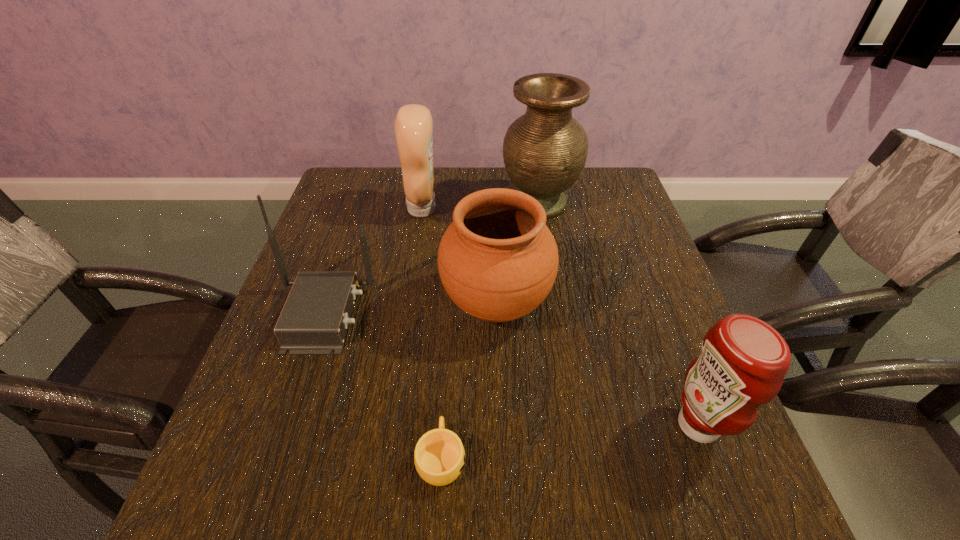
Where is `vase`? vase is located at coordinates (545, 150).

Image resolution: width=960 pixels, height=540 pixels. I want to click on the farther condiment, so click(x=413, y=127).

Where is `the left condiment`? The width and height of the screenshot is (960, 540). the left condiment is located at coordinates (413, 127).

At what (x,y) coordinates should I click in order to perform the action: click on pottery. Please return your answer as a coordinate pair (x, y). The height and width of the screenshot is (540, 960). Looking at the image, I should click on (498, 261).

Image resolution: width=960 pixels, height=540 pixels. I want to click on the rightmost object, so click(743, 361).

Image resolution: width=960 pixels, height=540 pixels. What are the coordinates of `the right condiment` in the screenshot? It's located at (743, 361).

Locate an element on the screen. This screenshot has width=960, height=540. router is located at coordinates (314, 320).

Find the location of a particular element. The width and height of the screenshot is (960, 540). the shortest object is located at coordinates (439, 456).

Identify the location of free space located 0.050m on the front of the vase. The image size is (960, 540). (545, 239).

At what (x,y) coordinates should I click in order to perform the action: click on vacant space situated 0.160m on the label of the second object from left to right. Please return your answer as a coordinate pair (x, y). Looking at the image, I should click on (495, 208).